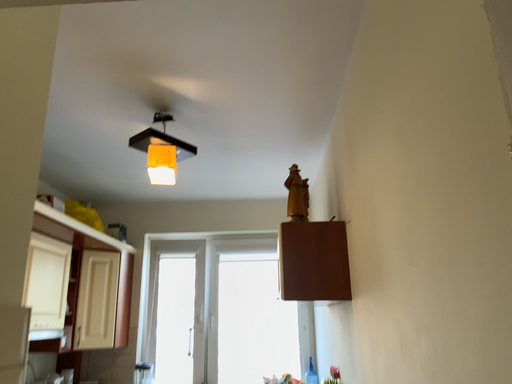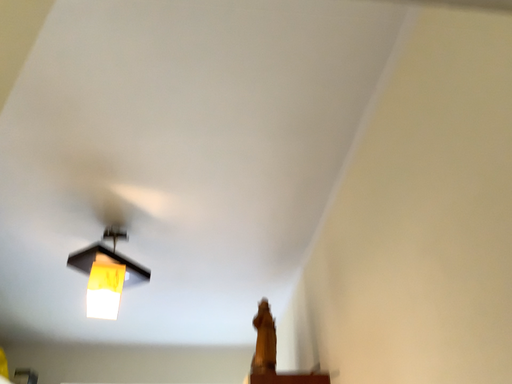
Question: How did the camera likely rotate when shooting the video?

Choices:
 (A) rotated right
 (B) rotated left

Answer: (A)